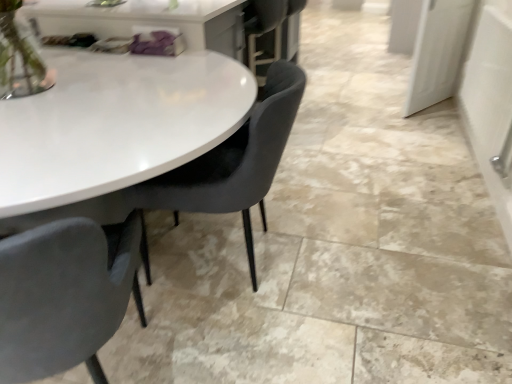
Question: Is velvet grey chair at center, which is the 2th chair from right to left, wider or thinner than white glossy door at upper right?

Choices:
 (A) thin
 (B) wide

Answer: (B)

Question: From the image's perspective, is velvet grey chair at center, which is the 2th chair from right to left, above or below white glossy door at upper right?

Choices:
 (A) below
 (B) above

Answer: (A)

Question: Which of these objects is positioned farthest from the matte black chair at center, acting as the 2th chair starting from the left?

Choices:
 (A) white glossy door at upper right
 (B) velvet grey chair at center, which is the 2th chair from right to left

Answer: (A)

Question: Which of these objects is positioned farthest from the white glossy door at upper right?

Choices:
 (A) velvet grey chair at center, which is the 2th chair from right to left
 (B) matte black chair at center, placed as the first chair when sorted from right to left

Answer: (A)